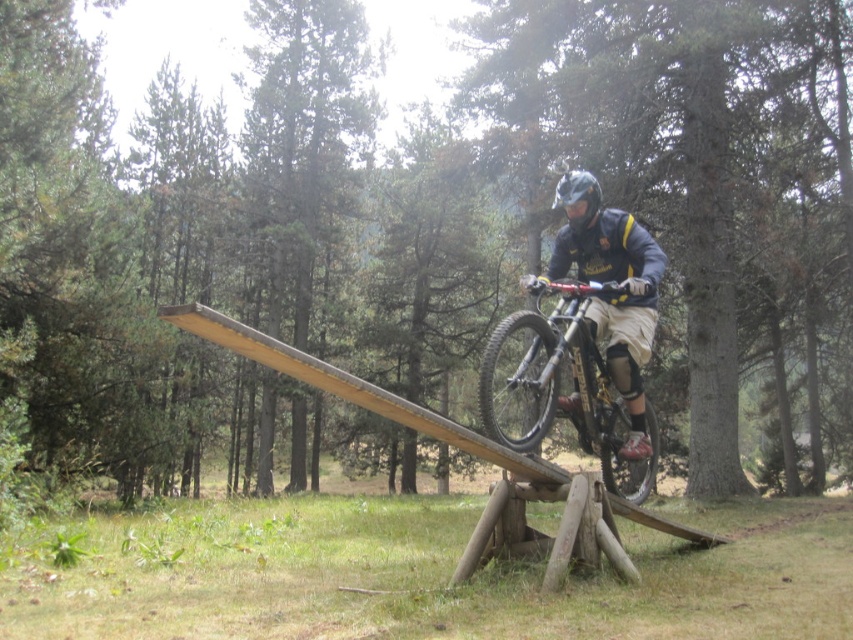
Question: Considering the relative positions of shiny metallic bicycle at center and matte black helmet at center in the image provided, where is shiny metallic bicycle at center located with respect to matte black helmet at center?

Choices:
 (A) below
 (B) above

Answer: (A)

Question: Is shiny metallic bicycle at center to the left of matte black helmet at center from the viewer's perspective?

Choices:
 (A) yes
 (B) no

Answer: (B)

Question: Among these objects, which one is farthest from the camera?

Choices:
 (A) shiny metallic bicycle at center
 (B) matte black helmet at center

Answer: (B)

Question: Which point is farther to the camera?

Choices:
 (A) (595, 264)
 (B) (585, 380)

Answer: (A)

Question: Can you confirm if shiny metallic bicycle at center is smaller than matte black helmet at center?

Choices:
 (A) no
 (B) yes

Answer: (A)

Question: Which object appears farthest from the camera in this image?

Choices:
 (A) shiny metallic bicycle at center
 (B) matte black helmet at center

Answer: (B)